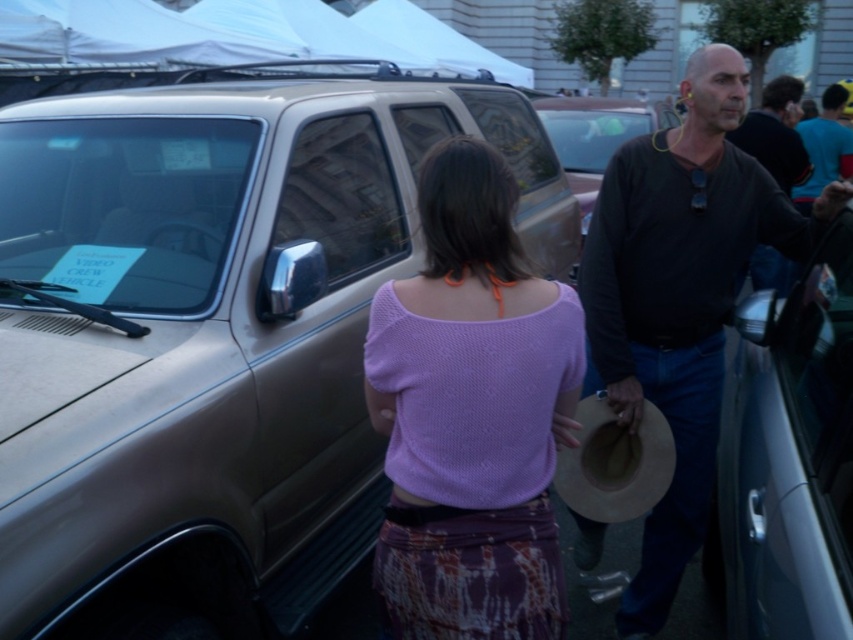
Question: Can you confirm if purple knit top at center is wider than metallic silver car door at right?

Choices:
 (A) no
 (B) yes

Answer: (A)

Question: Is purple knit top at center below metallic silver car door at right?

Choices:
 (A) no
 (B) yes

Answer: (A)

Question: Which object is farther from the camera taking this photo?

Choices:
 (A) purple knit top at center
 (B) metallic silver car door at right

Answer: (A)

Question: Among these objects, which one is farthest from the camera?

Choices:
 (A) purple knit top at center
 (B) metallic silver car door at right

Answer: (A)

Question: Can you confirm if purple knit top at center is thinner than black matte shirt at center?

Choices:
 (A) no
 (B) yes

Answer: (B)

Question: Which point is closer to the camera?

Choices:
 (A) purple knit top at center
 (B) metallic silver car door at right
 (C) black matte shirt at center

Answer: (B)